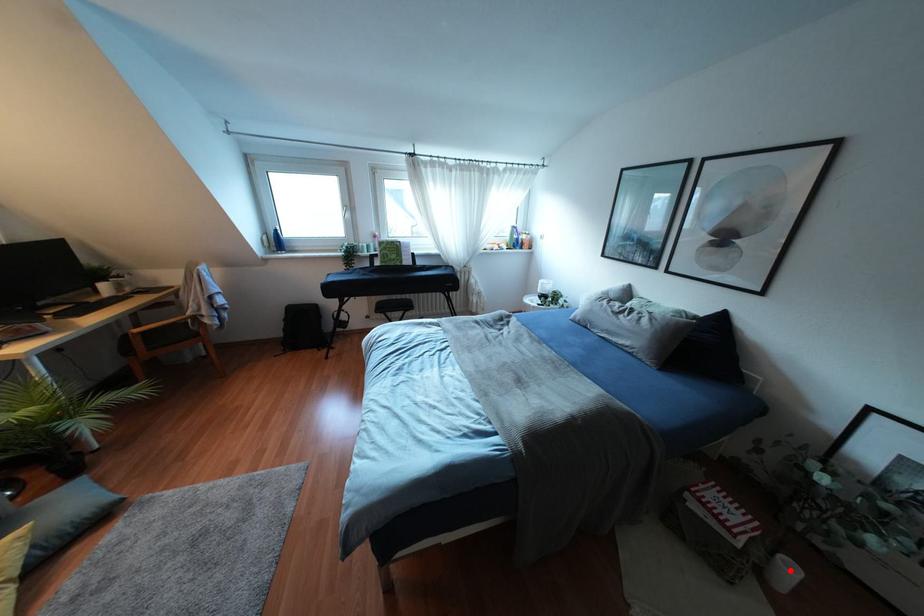
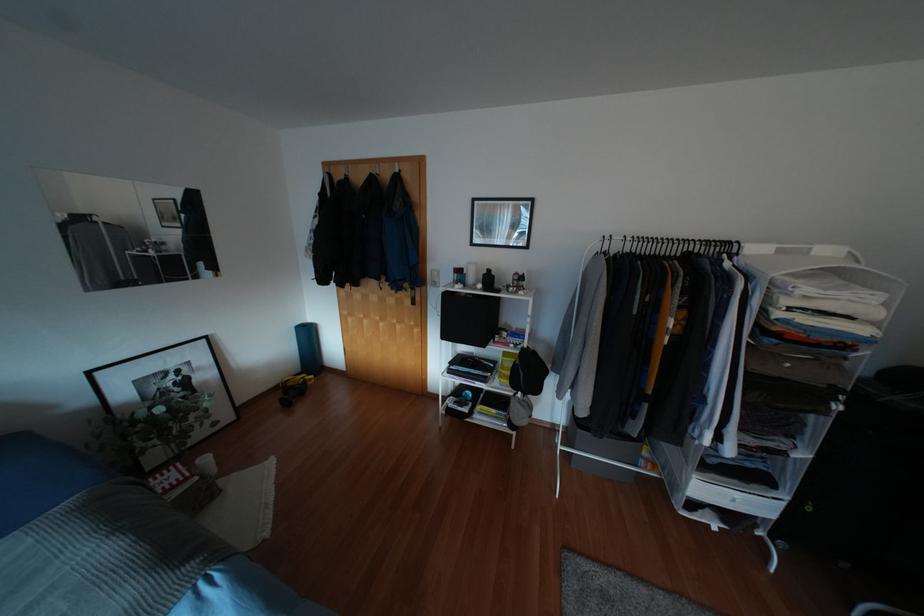
Locate, in the second image, the point that corresponds to the highlighted location in the first image.

(205, 459)